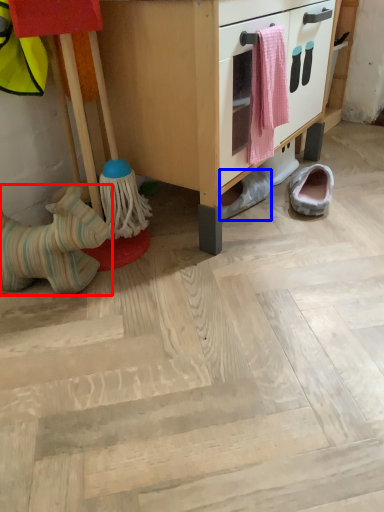
Question: Among these objects, which one is nearest to the camera, footwear (highlighted by a red box) or footwear (highlighted by a blue box)?

Choices:
 (A) footwear
 (B) footwear

Answer: (A)